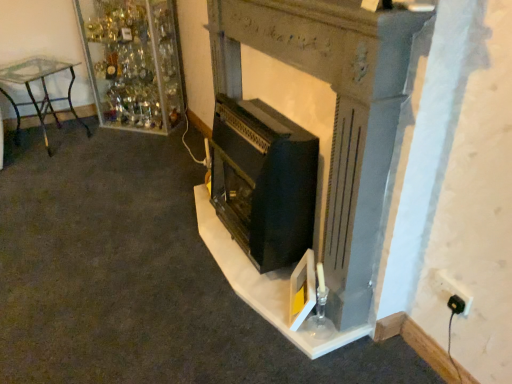
Question: Does point (369, 238) appear closer or farther from the camera than point (284, 153)?

Choices:
 (A) closer
 (B) farther

Answer: (A)

Question: In terms of height, does matte black fireplace at center look taller or shorter compared to black matte wood burning stove at center?

Choices:
 (A) short
 (B) tall

Answer: (B)

Question: Estimate the real-world distances between objects in this image. Which object is closer to the white plastic plug at lower right?

Choices:
 (A) black plastic plug at lower right
 (B) matte black fireplace at center
 (C) black matte wood burning stove at center
 (D) clear glass table at left
 (E) clear glass shelves at upper left

Answer: (A)

Question: Based on their relative distances, which object is nearer to the clear glass table at left?

Choices:
 (A) clear glass shelves at upper left
 (B) black matte wood burning stove at center
 (C) black plastic plug at lower right
 (D) white plastic plug at lower right
 (E) matte black fireplace at center

Answer: (A)